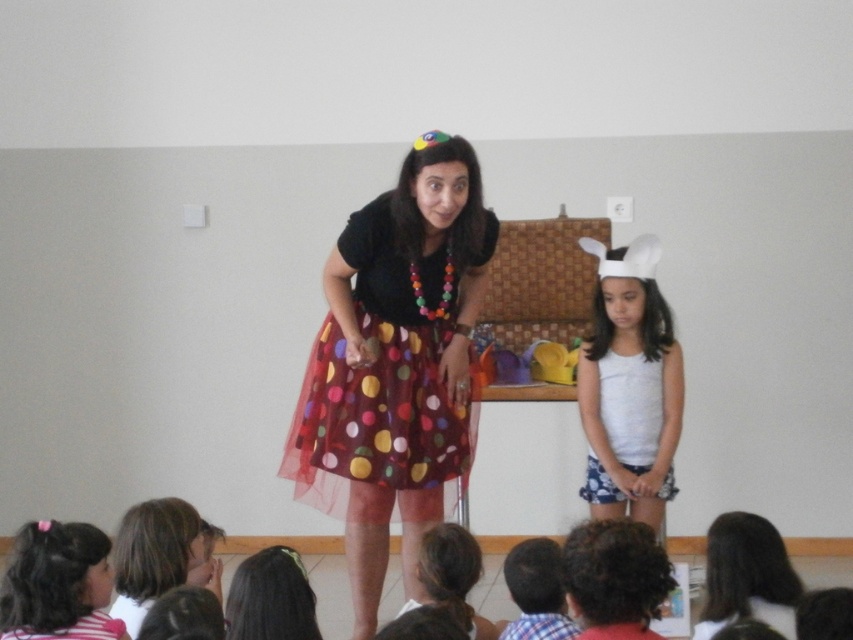
Question: Which object is the closest to the polka dot tulle skirt at center?

Choices:
 (A) blonde hair at lower left
 (B) white matte tank top at center
 (C) pink hairband at lower left
 (D) curly hair at lower center

Answer: (A)

Question: Does blonde hair at lower left have a larger size compared to smooth brown hair at lower right?

Choices:
 (A) yes
 (B) no

Answer: (A)

Question: Is white matte tank top at center thinner than pink hairband at lower left?

Choices:
 (A) no
 (B) yes

Answer: (A)

Question: Among these objects, which one is farthest from the camera?

Choices:
 (A) white matte tank top at center
 (B) curly hair at lower center
 (C) pink hairband at lower left

Answer: (A)

Question: Can you confirm if blonde hair at lower left is positioned to the right of smooth dark hair at lower center?

Choices:
 (A) yes
 (B) no

Answer: (B)

Question: Which point is closer to the camera?

Choices:
 (A) (82, 632)
 (B) (172, 500)
 (C) (457, 577)

Answer: (A)